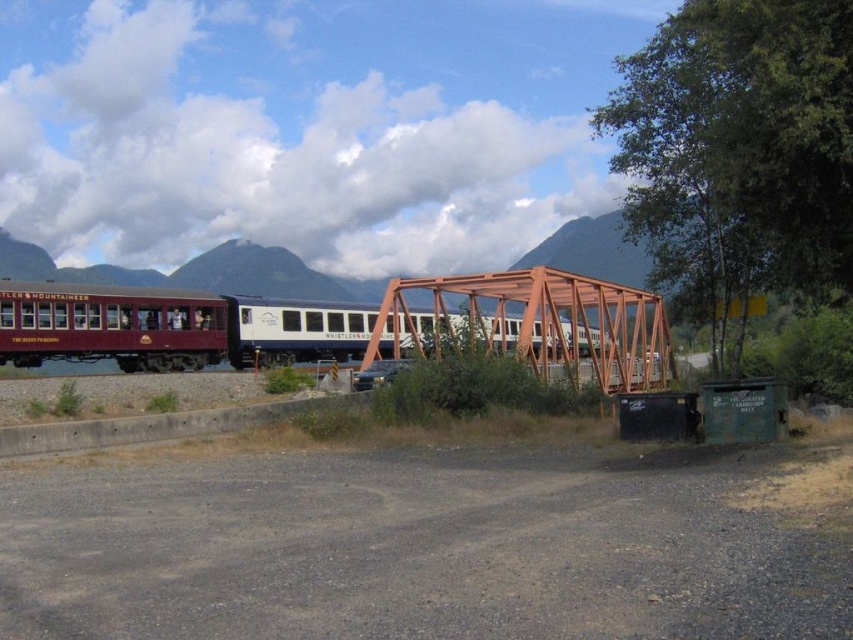
Which of these two, maroon polished wood train car at left or orange metal bridge at center, stands shorter?

With less height is orange metal bridge at center.

Looking at this image, can you confirm if maroon polished wood train car at left is thinner than orange metal bridge at center?

Incorrect, maroon polished wood train car at left's width is not less than orange metal bridge at center's.

Find the location of `maroon polished wood train car at left`. maroon polished wood train car at left is located at coordinates (172, 326).